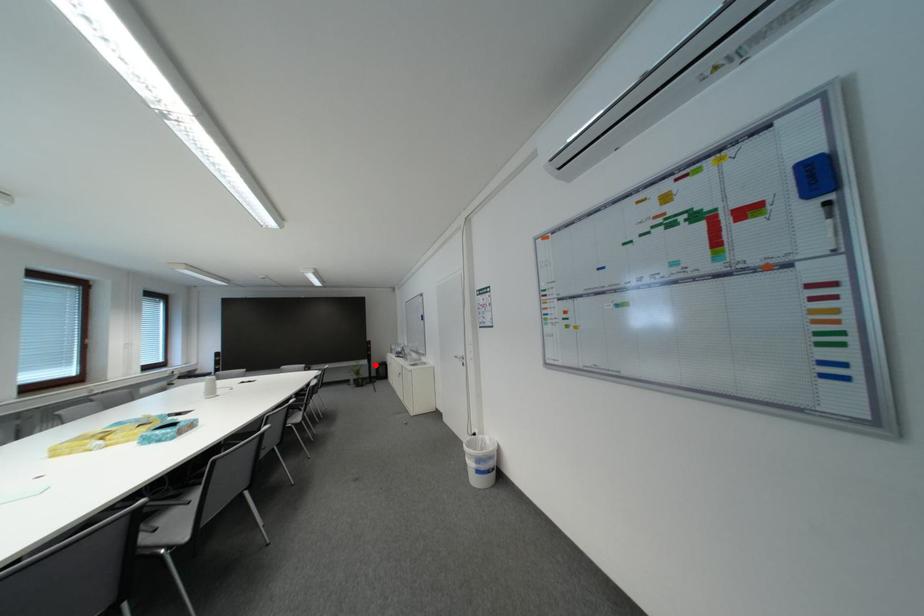
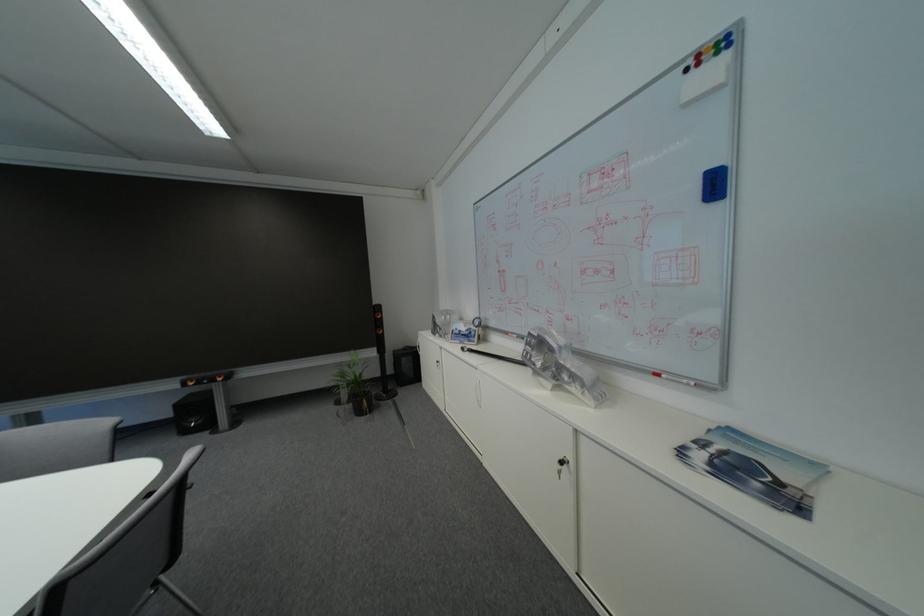
Question: I am providing you with two images of the same scene from different viewpoints. A red point is shown in image1. For the corresponding object point in image2, is it positioned nearer or farther from the camera?

Choices:
 (A) Nearer
 (B) Farther

Answer: (A)